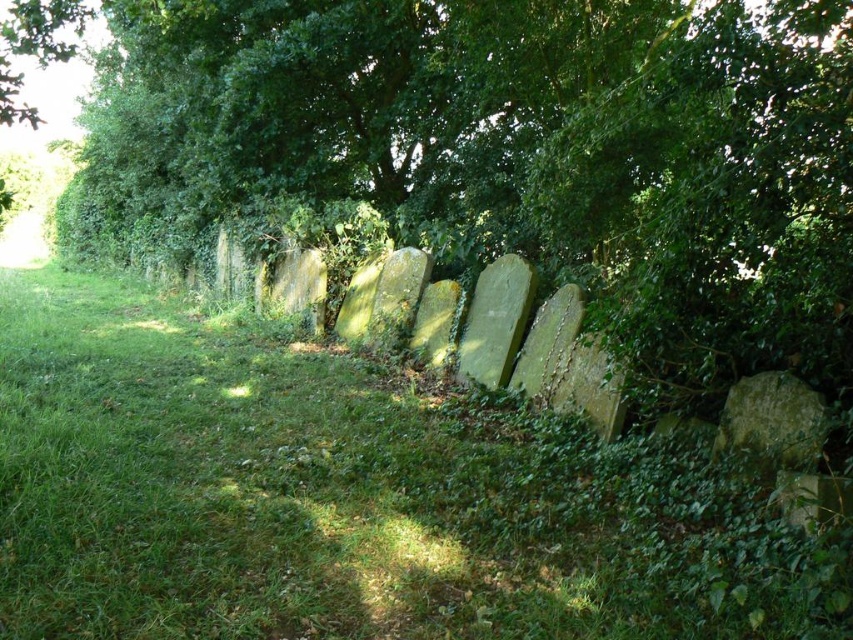
You are planning to place a small garden statue in the scene. The statue requires a spot that is both green and has enough space. Based on the image, which location would be more suitable between the green grassy at center and the green leafy tree at center?

The green grassy at center is more suitable because it is green and has enough space since it has a smaller size compared to the green leafy tree at center. Wait, but the description says the grassy area is smaller than the tree. Hmm, maybe I need to rephrase. Since the grassy area is smaller, does that mean it has less space? Wait, the question is about enough space. If the grassy area is smaller than the tree, maybe the tree is larger, so the grassy area might have less space. Wait, the answer might be to

You are standing in the middle of the cemetery path and see the green grassy at center and the green leafy tree at center. Which one is wider?

The green leafy tree at center is wider than the green grassy at center.

You are standing at the entrance of the cemetery and see the green grassy area at center. If you were to walk directly towards the green grassy at center, which direction should you head?

The green grassy at center is located at point (347, 499), which is towards the lower right of the image. Therefore, you should head towards the lower right direction to reach it.